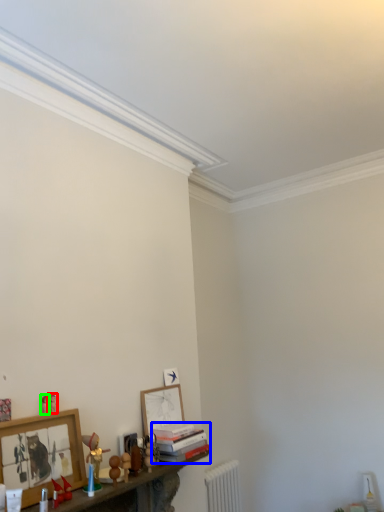
Question: Which object is positioned closest to toy (highlighted by a red box)? Select from book (highlighted by a blue box) and toy (highlighted by a green box).

Choices:
 (A) book
 (B) toy

Answer: (B)